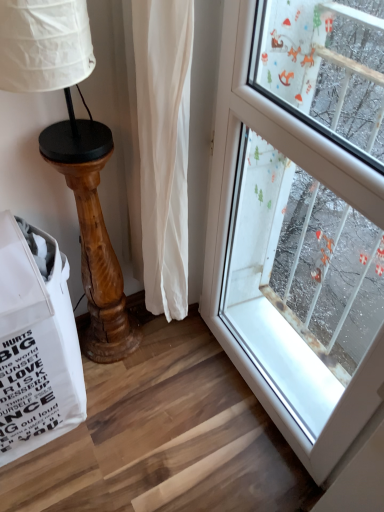
Question: Considering the relative positions of white fabric grocery bag at lower left and wooden table lamp at left in the image provided, is white fabric grocery bag at lower left to the left or to the right of wooden table lamp at left?

Choices:
 (A) right
 (B) left

Answer: (B)

Question: Relative to wooden table lamp at left, is white fabric grocery bag at lower left in front or behind?

Choices:
 (A) behind
 (B) front

Answer: (B)

Question: Is white fabric grocery bag at lower left situated inside wooden table lamp at left or outside?

Choices:
 (A) outside
 (B) inside

Answer: (A)

Question: Is wooden table lamp at left taller or shorter than white fabric grocery bag at lower left?

Choices:
 (A) tall
 (B) short

Answer: (A)

Question: Is wooden table lamp at left bigger or smaller than white fabric grocery bag at lower left?

Choices:
 (A) big
 (B) small

Answer: (B)

Question: Is wooden table lamp at left in front of or behind white fabric grocery bag at lower left in the image?

Choices:
 (A) behind
 (B) front

Answer: (A)

Question: From the image's perspective, is wooden table lamp at left positioned above or below white fabric grocery bag at lower left?

Choices:
 (A) above
 (B) below

Answer: (A)